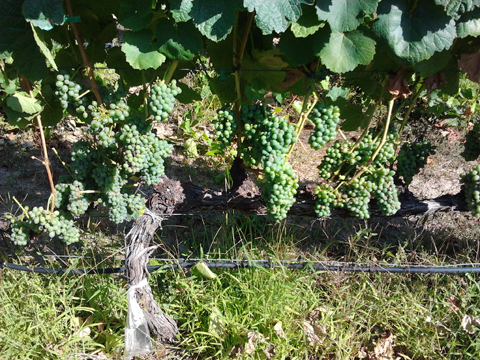
At what (x,y) coordinates should I click in order to perform the action: click on black cable. Please return your answer as a coordinate pair (x, y). The width and height of the screenshot is (480, 360). Looking at the image, I should click on (407, 270), (28, 265), (58, 255).